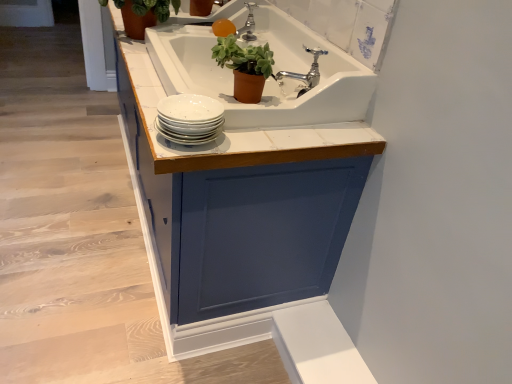
Question: From their relative heights in the image, would you say green matte plant pot at upper center, arranged as the 2th houseplant when viewed from the left, is taller or shorter than white glossy plates at center?

Choices:
 (A) tall
 (B) short

Answer: (A)

Question: Considering their positions, is green matte plant pot at upper center, arranged as the 2th houseplant when viewed from the back, located in front of or behind white glossy plates at center?

Choices:
 (A) behind
 (B) front

Answer: (A)

Question: Which object is the farthest from the green matte plant at upper left, which is counted as the first houseplant, starting from the back?

Choices:
 (A) chrome metallic faucet at upper center, positioned as the first tap in front-to-back order
 (B) white glossy cabinet at upper center
 (C) blue painted cabinet at center
 (D) green matte plant pot at upper center, positioned as the first houseplant in right-to-left order
 (E) white ceramic sink at upper center

Answer: (B)

Question: Which object is positioned closest to the silver metallic tap at upper center, which is the 1th tap in top-to-bottom order?

Choices:
 (A) chrome metallic faucet at upper center, acting as the first tap starting from the right
 (B) blue painted cabinet at center
 (C) white glossy plates at center
 (D) white ceramic sink at upper center
 (E) white glossy cabinet at upper center

Answer: (D)